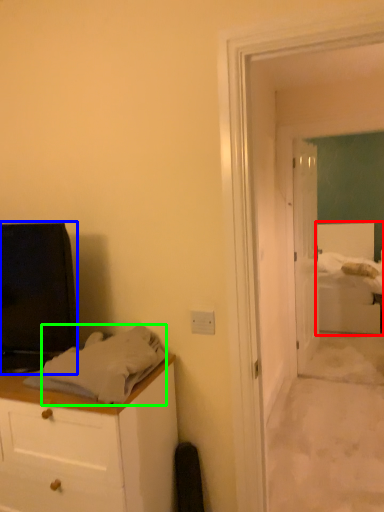
Question: Based on their relative distances, which object is nearer to bed (highlighted by a red box)? Choose from television (highlighted by a blue box) and sheet (highlighted by a green box).

Choices:
 (A) television
 (B) sheet

Answer: (B)